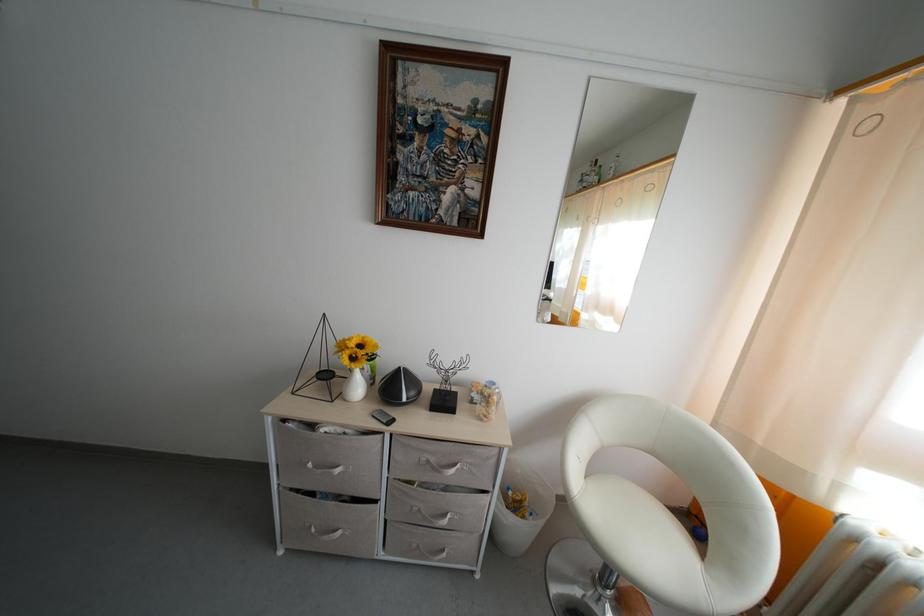
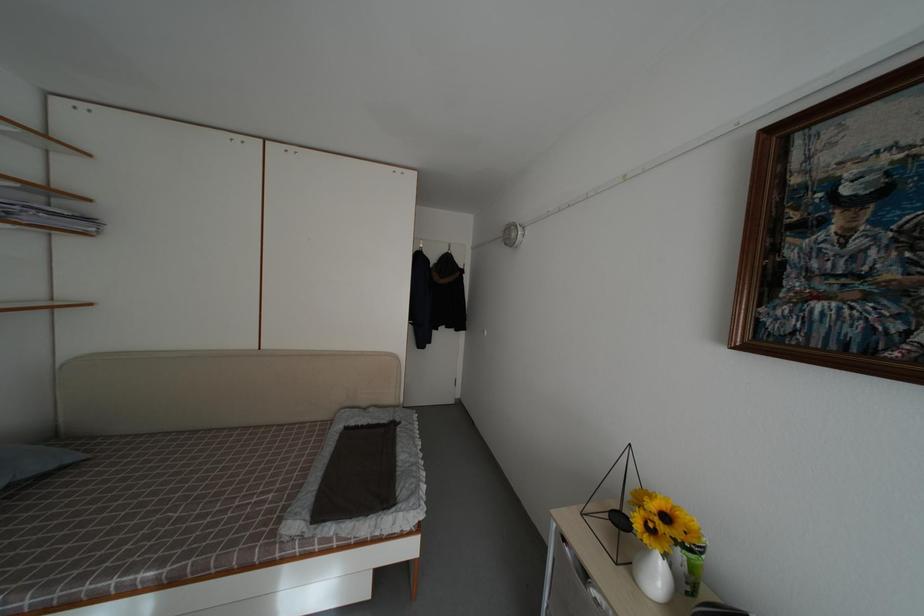
The point at (363, 394) is marked in the first image. Where is the corresponding point in the second image?

(664, 584)